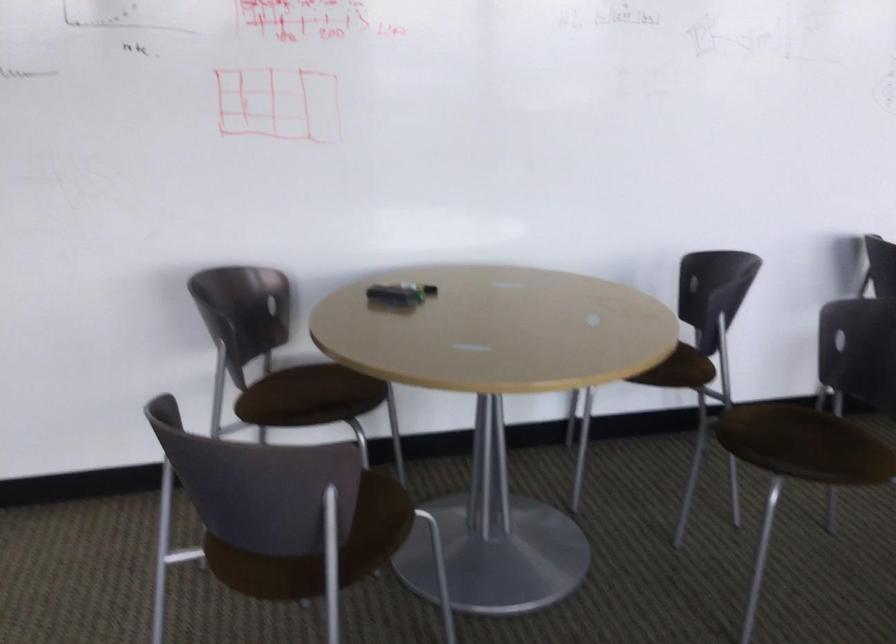
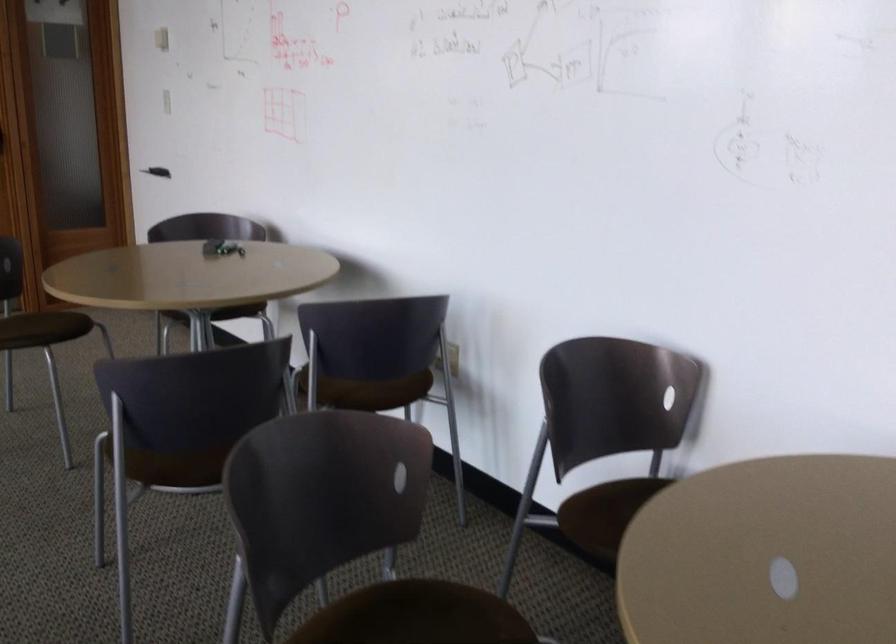
Where in the second image is the point corresponding to (688,371) from the first image?

(347, 392)